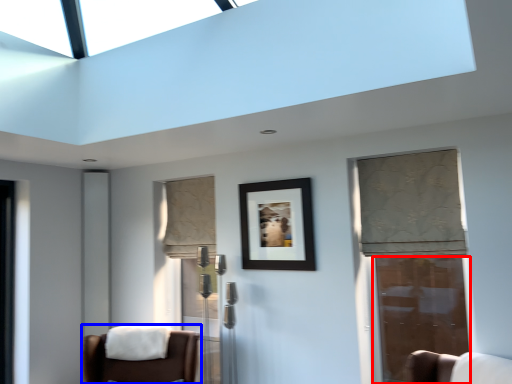
Question: Which of the following is the closest to the observer, door (highlighted by a red box) or chair (highlighted by a blue box)?

Choices:
 (A) door
 (B) chair

Answer: (B)